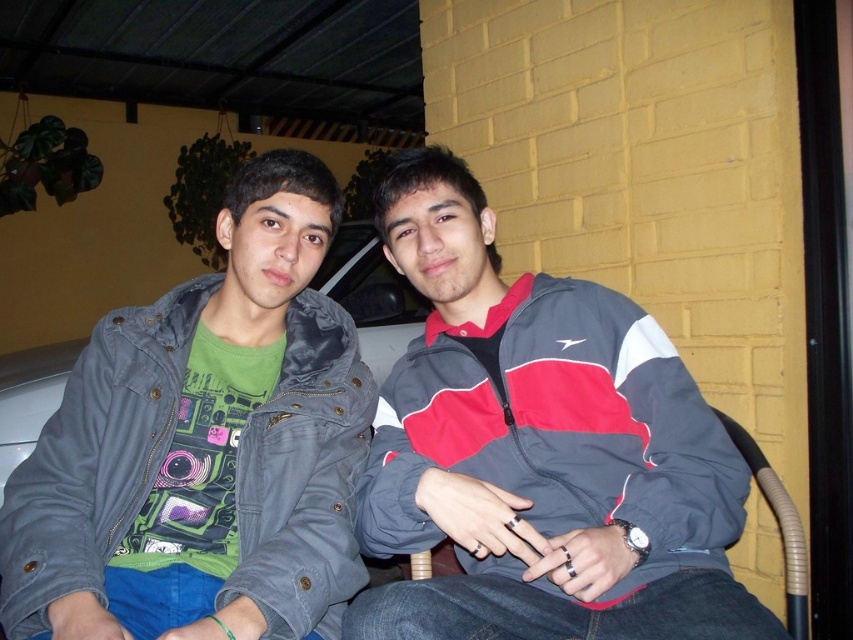
Question: Does gray/red/white jacket at center appear on the right side of denim jacket at left?

Choices:
 (A) no
 (B) yes

Answer: (B)

Question: Which point is closer to the camera?

Choices:
 (A) gray/red/white jacket at center
 (B) denim jacket at left

Answer: (A)

Question: Is gray/red/white jacket at center in front of denim jacket at left?

Choices:
 (A) yes
 (B) no

Answer: (A)

Question: Does gray/red/white jacket at center have a larger size compared to denim jacket at left?

Choices:
 (A) no
 (B) yes

Answer: (B)